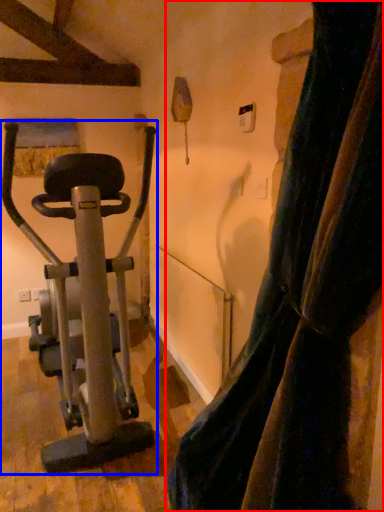
Question: Which point is closer to the camera, curtain (highlighted by a red box) or stationary bicycle (highlighted by a blue box)?

Choices:
 (A) curtain
 (B) stationary bicycle

Answer: (A)